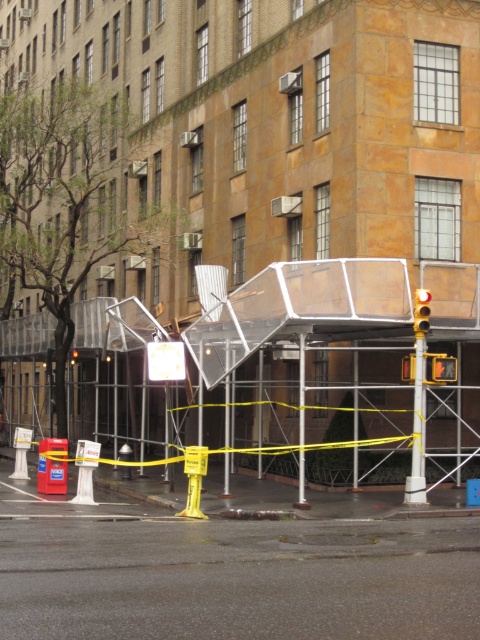
You are a pedestrian waiting to cross the street. You see the metallic yellow pole at right and the yellow plastic traffic light at center. Which object is closer to you?

The metallic yellow pole at right is closer to you than the yellow plastic traffic light at center because the traffic light is behind the pole.

You are a delivery person with a 3.5 feet wide cart. You need to navigate between the metallic yellow pole at right and the yellow plastic traffic light at center. Is there enough space for your cart to pass through?

The distance between the metallic yellow pole at right and the yellow plastic traffic light at center is 3.46 feet. Since your cart is 3.5 feet wide, there is not enough space for the cart to pass through safely.

You are standing in front of the building and want to determine which of the two points, point [421,449] or point [425,300], is closer to you. Based on the image, which point is nearer?

Point [421,449] is further to the viewer than point [425,300], so point [425,300] is closer to you.